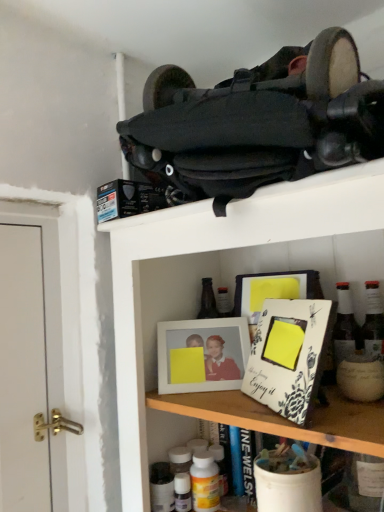
Measure the distance between yellow matte bottle at lower center and camera.

They are 90.55 centimeters apart.

This screenshot has width=384, height=512. Describe the element at coordinates (205, 482) in the screenshot. I see `yellow matte bottle at lower center` at that location.

What is the approximate width of yellow matte bottle at lower center?

It is 4.06 inches.

In order to click on yellow matte bottle at lower center in this screenshot , I will do `click(205, 482)`.

This screenshot has height=512, width=384. What are the coordinates of `white matte picture frame at center` in the screenshot? It's located at (202, 355).

Describe the element at coordinates (202, 355) in the screenshot. I see `white matte picture frame at center` at that location.

The height and width of the screenshot is (512, 384). What are the coordinates of `yellow matte bottle at lower center` in the screenshot? It's located at (205, 482).

Visually, is yellow matte bottle at lower center positioned to the left or to the right of white matte picture frame at center?

In the image, yellow matte bottle at lower center appears on the right side of white matte picture frame at center.

Does yellow matte bottle at lower center come behind white matte picture frame at center?

No, it is in front of white matte picture frame at center.

Which point is more forward, (203, 511) or (198, 354)?

The point (203, 511) is closer.

From the image's perspective, is yellow matte bottle at lower center located above or below white matte picture frame at center?

yellow matte bottle at lower center is situated lower than white matte picture frame at center in the image.

From a real-world perspective, does yellow matte bottle at lower center stand above white matte picture frame at center?

No, from a real-world perspective, yellow matte bottle at lower center is not on top of white matte picture frame at center.

Which object is wider, yellow matte bottle at lower center or white matte picture frame at center?

yellow matte bottle at lower center is wider.

Considering the relative sizes of yellow matte bottle at lower center and white matte picture frame at center in the image provided, is yellow matte bottle at lower center shorter than white matte picture frame at center?

Indeed, yellow matte bottle at lower center has a lesser height compared to white matte picture frame at center.

Between yellow matte bottle at lower center and white matte picture frame at center, which one has larger size?

white matte picture frame at center.

Is yellow matte bottle at lower center not within white matte picture frame at center?

Yes, yellow matte bottle at lower center is located beyond the bounds of white matte picture frame at center.

Can you see yellow matte bottle at lower center touching white matte picture frame at center?

No, yellow matte bottle at lower center is not next to white matte picture frame at center.

Is yellow matte bottle at lower center oriented away from white matte picture frame at center?

That's not correct — yellow matte bottle at lower center is not looking away from white matte picture frame at center.

You are a GUI agent. You are given a task and a screenshot of the screen. Output one action in this format:
    pyautogui.click(x=<x>, y=<y>)
    Task: Click on the bottle to the right of white matte picture frame at center
    This screenshot has width=384, height=512.
    Given the screenshot: What is the action you would take?
    pyautogui.click(x=205, y=482)

Can you confirm if white matte picture frame at center is positioned to the right of yellow matte bottle at lower center?

No, white matte picture frame at center is not to the right of yellow matte bottle at lower center.

From the picture: Considering their positions, is white matte picture frame at center located in front of or behind yellow matte bottle at lower center?

In the image, white matte picture frame at center appears behind yellow matte bottle at lower center.

Considering the points (166, 356) and (214, 492), which point is in front, point (166, 356) or point (214, 492)?

The point (214, 492) is more forward.

From the image's perspective, is white matte picture frame at center above yellow matte bottle at lower center?

Yes, from the image's perspective, white matte picture frame at center is on top of yellow matte bottle at lower center.

Based on the photo, from a real-world perspective, relative to yellow matte bottle at lower center, is white matte picture frame at center vertically above or below?

Clearly, from a real-world perspective, white matte picture frame at center is above yellow matte bottle at lower center.

Is white matte picture frame at center thinner than yellow matte bottle at lower center?

Indeed, white matte picture frame at center has a lesser width compared to yellow matte bottle at lower center.

Between white matte picture frame at center and yellow matte bottle at lower center, which one has less height?

Standing shorter between the two is yellow matte bottle at lower center.

Considering the sizes of white matte picture frame at center and yellow matte bottle at lower center in the image, is white matte picture frame at center bigger or smaller than yellow matte bottle at lower center?

A: Considering their sizes, white matte picture frame at center takes up more space than yellow matte bottle at lower center.

Is yellow matte bottle at lower center located within white matte picture frame at center?

No, yellow matte bottle at lower center is not a part of white matte picture frame at center.

Does white matte picture frame at center touch yellow matte bottle at lower center?

No, white matte picture frame at center is not in contact with yellow matte bottle at lower center.

Could you tell me if white matte picture frame at center is facing yellow matte bottle at lower center?

No.

The image size is (384, 512). In order to click on bottle below the white matte picture frame at center (from a real-world perspective) in this screenshot , I will do `click(205, 482)`.

Where is `bottle on the right of white matte picture frame at center`? The image size is (384, 512). bottle on the right of white matte picture frame at center is located at coordinates (205, 482).

Locate an element on the screen. picture frame that appears above the yellow matte bottle at lower center (from a real-world perspective) is located at coordinates (202, 355).